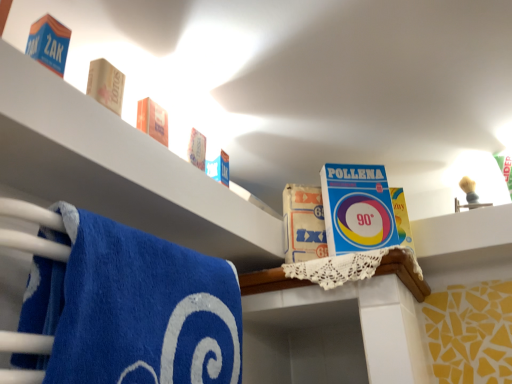
The width and height of the screenshot is (512, 384). Describe the element at coordinates (106, 85) in the screenshot. I see `wooden block at upper left, the second product in the bottom-to-top sequence` at that location.

This screenshot has width=512, height=384. Describe the element at coordinates (131, 308) in the screenshot. I see `blue terry cloth towel at lower left` at that location.

What do you see at coordinates (49, 43) in the screenshot? Image resolution: width=512 pixels, height=384 pixels. I see `blue cardboard box at upper left, the 3th product from the bottom` at bounding box center [49, 43].

Locate an element on the screen. This screenshot has height=384, width=512. wooden block at upper left, which appears as the 2th product when viewed from the top is located at coordinates (106, 85).

Considering the sizes of blue cardboard box at upper left, placed as the third product when sorted from back to front, and blue terry cloth towel at lower left in the image, is blue cardboard box at upper left, placed as the third product when sorted from back to front, wider or thinner than blue terry cloth towel at lower left?

Clearly, blue cardboard box at upper left, placed as the third product when sorted from back to front, has less width compared to blue terry cloth towel at lower left.

Looking at this image, would you say blue cardboard box at upper left, marked as the first product in a top-to-bottom arrangement, contains blue terry cloth towel at lower left?

No.

Is blue cardboard box at upper left, which ranks as the first product in left-to-right order, at the right side of blue terry cloth towel at lower left?

No, blue cardboard box at upper left, which ranks as the first product in left-to-right order, is not to the right of blue terry cloth towel at lower left.

Does blue terry cloth towel at lower left have a larger size compared to wooden block at upper left, the second product in the bottom-to-top sequence?

Yes.

Which of these two, blue terry cloth towel at lower left or wooden block at upper left, which appears as the 2th product when viewed from the top, is wider?

blue terry cloth towel at lower left is wider.

From a real-world perspective, is blue terry cloth towel at lower left above or below wooden block at upper left, which appears as the 2th product when viewed from the top?

blue terry cloth towel at lower left is situated lower than wooden block at upper left, which appears as the 2th product when viewed from the top, in the real world.

Is the surface of blue terry cloth towel at lower left in direct contact with wooden block at upper left, which ranks as the second product in right-to-left order?

No, blue terry cloth towel at lower left is not touching wooden block at upper left, which ranks as the second product in right-to-left order.

From a real-world perspective, is wooden block at upper left, which ranks as the second product in right-to-left order, located higher than blue cardboard box at upper left?

Yes, from a real-world perspective, wooden block at upper left, which ranks as the second product in right-to-left order, is on top of blue cardboard box at upper left.

Who is bigger, wooden block at upper left, acting as the second product starting from the front, or blue cardboard box at upper left?

blue cardboard box at upper left.

Considering the relative sizes of wooden block at upper left, acting as the second product starting from the front, and blue cardboard box at upper left in the image provided, is wooden block at upper left, acting as the second product starting from the front, shorter than blue cardboard box at upper left?

Correct, wooden block at upper left, acting as the second product starting from the front, is not as tall as blue cardboard box at upper left.

Considering the sizes of objects wooden block at upper left, which appears as the 2th product when viewed from the top, and blue cardboard box at upper left in the image provided, who is thinner, wooden block at upper left, which appears as the 2th product when viewed from the top, or blue cardboard box at upper left?

Thinner between the two is wooden block at upper left, which appears as the 2th product when viewed from the top.

Considering the relative sizes of blue cardboard box at upper left, the 3th product from the bottom, and blue cardboard box at upper left in the image provided, is blue cardboard box at upper left, the 3th product from the bottom, thinner than blue cardboard box at upper left?

Correct, the width of blue cardboard box at upper left, the 3th product from the bottom, is less than that of blue cardboard box at upper left.

At what (x,y) coordinates should I click in order to perform the action: click on the 2nd product to the left of the blue cardboard box at upper left, counting from the anchor's position. Please return your answer as a coordinate pair (x, y). Looking at the image, I should click on (49, 43).

Is blue cardboard box at upper left, which ranks as the first product in left-to-right order, not within blue cardboard box at upper left?

Yes, blue cardboard box at upper left, which ranks as the first product in left-to-right order, is outside of blue cardboard box at upper left.

Is blue cardboard box at upper left, placed as the third product when sorted from back to front, in front of or behind blue cardboard box at upper left in the image?

Visually, blue cardboard box at upper left, placed as the third product when sorted from back to front, is located behind blue cardboard box at upper left.

Considering the sizes of objects blue terry cloth towel at lower left and blue cardboard box at upper left, placed as the third product when sorted from back to front, in the image provided, who is bigger, blue terry cloth towel at lower left or blue cardboard box at upper left, placed as the third product when sorted from back to front,?

With larger size is blue terry cloth towel at lower left.

Is the depth of blue terry cloth towel at lower left greater than that of blue cardboard box at upper left, the 3th product from the bottom?

No, it is in front of blue cardboard box at upper left, the 3th product from the bottom.

Looking at this image, is blue cardboard box at upper left oriented away from blue cardboard box at upper left, placed as the 1th product when sorted from front to back?

blue cardboard box at upper left is not turned away from blue cardboard box at upper left, placed as the 1th product when sorted from front to back.

From the image's perspective, which one is positioned lower, blue cardboard box at upper left or blue cardboard box at upper left, the 3th product from the bottom?

blue cardboard box at upper left appears lower in the image.

Considering the positions of point (7, 62) and point (47, 45), is point (7, 62) closer or farther from the camera than point (47, 45)?

Point (7, 62) is closer to the camera than point (47, 45).

Looking at this image, from a real-world perspective, is blue cardboard box at upper left positioned under blue cardboard box at upper left, the 3th product from the bottom, based on gravity?

Yes, from a real-world perspective, blue cardboard box at upper left is under blue cardboard box at upper left, the 3th product from the bottom.

Is blue cardboard box at upper center, the 1th product in the back-to-front sequence, inside blue cardboard box at upper left?

That's incorrect, blue cardboard box at upper center, the 1th product in the back-to-front sequence, is not inside blue cardboard box at upper left.

From the image's perspective, is blue cardboard box at upper left above blue cardboard box at upper center, the 3th product when ordered from top to bottom?

Yes.

Considering the relative sizes of blue cardboard box at upper left and blue cardboard box at upper center, the 3th product in the front-to-back sequence, in the image provided, is blue cardboard box at upper left wider than blue cardboard box at upper center, the 3th product in the front-to-back sequence,?

Yes.

Based on the photo, does blue cardboard box at upper left have a smaller size compared to blue cardboard box at upper center, the first product when ordered from bottom to top?

No.

Where is `towel in front of the blue cardboard box at upper left, placed as the third product when sorted from back to front`? towel in front of the blue cardboard box at upper left, placed as the third product when sorted from back to front is located at coordinates (131, 308).

The width and height of the screenshot is (512, 384). Identify the location of towel below the wooden block at upper left, which appears as the 2th product when viewed from the top (from a real-world perspective). (131, 308).

Based on their spatial positions, is blue cardboard box at upper center, which is the first product in right-to-left order, or blue terry cloth towel at lower left closer to wooden block at upper left, acting as the 2th product starting from the back?

The object closer to wooden block at upper left, acting as the 2th product starting from the back, is blue terry cloth towel at lower left.

Estimate the real-world distances between objects in this image. Which object is further from blue cardboard box at upper center, the 3th product when ordered from top to bottom, blue terry cloth towel at lower left or wooden block at upper left, which ranks as the second product in right-to-left order?

wooden block at upper left, which ranks as the second product in right-to-left order, is further to blue cardboard box at upper center, the 3th product when ordered from top to bottom.

Considering their positions, is blue cardboard box at upper left positioned closer to blue terry cloth towel at lower left than blue cardboard box at upper center, the 3th product when ordered from top to bottom?

blue cardboard box at upper left is closer to blue terry cloth towel at lower left.

Which object lies further to the anchor point blue cardboard box at upper left, blue cardboard box at upper left, the 3th product from the bottom, or blue terry cloth towel at lower left?

blue cardboard box at upper left, the 3th product from the bottom.

Looking at the image, which one is located further to blue cardboard box at upper left, blue cardboard box at upper left, which ranks as the first product in left-to-right order, or blue cardboard box at upper center, the third product positioned from the left?

Among the two, blue cardboard box at upper center, the third product positioned from the left, is located further to blue cardboard box at upper left.

Looking at the image, which one is located further to wooden block at upper left, which ranks as the second product in right-to-left order, blue cardboard box at upper left or blue cardboard box at upper left, the 3th product from the bottom?

blue cardboard box at upper left is positioned further to the anchor wooden block at upper left, which ranks as the second product in right-to-left order.

Based on their spatial positions, is blue terry cloth towel at lower left or wooden block at upper left, which ranks as the second product in right-to-left order, further from blue cardboard box at upper left, the 3th product from the bottom?

The object further to blue cardboard box at upper left, the 3th product from the bottom, is blue terry cloth towel at lower left.

Estimate the real-world distances between objects in this image. Which object is closer to blue cardboard box at upper center, the third product positioned from the left, blue cardboard box at upper left, which ranks as the first product in left-to-right order, or blue terry cloth towel at lower left?

blue terry cloth towel at lower left.

I want to click on product between blue cardboard box at upper left, placed as the third product when sorted from right to left, and blue cardboard box at upper left in the up-down direction, so click(106, 85).

Image resolution: width=512 pixels, height=384 pixels. What are the coordinates of `shelf between blue cardboard box at upper left, marked as the first product in a top-to-bottom arrangement, and blue terry cloth towel at lower left from top to bottom` in the screenshot? It's located at (119, 170).

At what (x,y) coordinates should I click in order to perform the action: click on product between blue cardboard box at upper left, the 3th product from the bottom, and blue cardboard box at upper center, the 3th product when ordered from top to bottom, from front to back. Please return your answer as a coordinate pair (x, y). Image resolution: width=512 pixels, height=384 pixels. Looking at the image, I should click on (106, 85).

You are a GUI agent. You are given a task and a screenshot of the screen. Output one action in this format:
    pyautogui.click(x=<x>, y=<y>)
    Task: Click on the shelf between wooden block at upper left, which ranks as the second product in right-to-left order, and blue terry cloth towel at lower left in the up-down direction
    
    Given the screenshot: What is the action you would take?
    pyautogui.click(x=119, y=170)